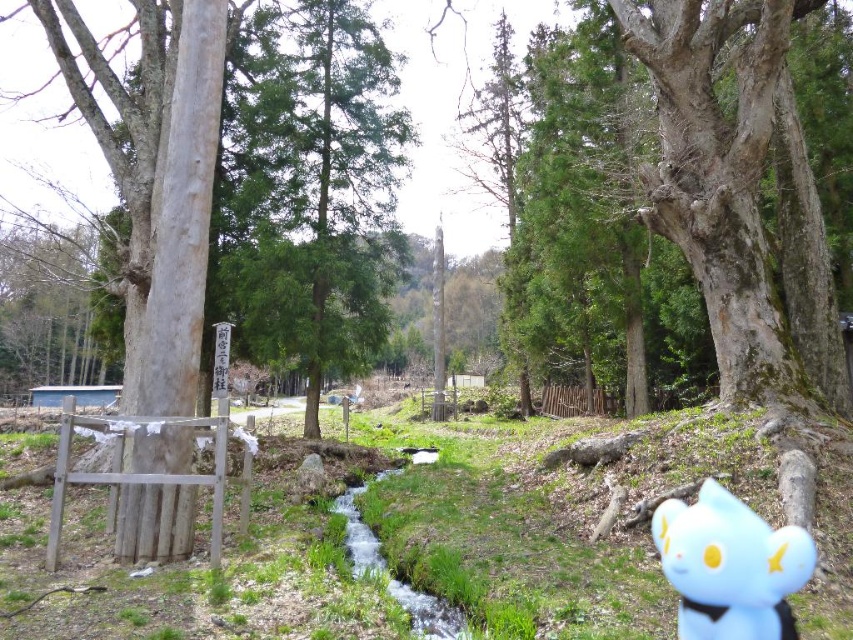
Question: Which point is farther from the camera taking this photo?

Choices:
 (A) (730, 595)
 (B) (457, 625)

Answer: (B)

Question: Does blue plush toy at lower right have a smaller size compared to clear water stream at center?

Choices:
 (A) no
 (B) yes

Answer: (A)

Question: Does blue plush toy at lower right have a smaller size compared to clear water stream at center?

Choices:
 (A) yes
 (B) no

Answer: (B)

Question: Can you confirm if blue plush toy at lower right is thinner than clear water stream at center?

Choices:
 (A) yes
 (B) no

Answer: (B)

Question: Which object is farther from the camera taking this photo?

Choices:
 (A) blue plush toy at lower right
 (B) clear water stream at center

Answer: (B)